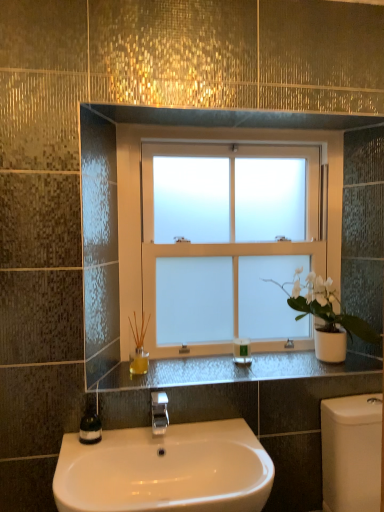
This screenshot has height=512, width=384. Describe the element at coordinates (203, 140) in the screenshot. I see `frosted glass window at center` at that location.

At what (x,y) coordinates should I click in order to perform the action: click on black granite counter at center. Please return your answer as a coordinate pair (x, y). This screenshot has width=384, height=512. Looking at the image, I should click on (232, 371).

The image size is (384, 512). What do you see at coordinates (159, 412) in the screenshot? I see `silver metallic faucet at center` at bounding box center [159, 412].

Find the location of a particular element. The image size is (384, 512). white glossy sink at lower center is located at coordinates (165, 470).

Can we say green glass soap dispenser at lower left lies outside green plastic bottle at center?

Yes, green glass soap dispenser at lower left is not within green plastic bottle at center.

Does green glass soap dispenser at lower left appear on the left side of green plastic bottle at center?

Correct, you'll find green glass soap dispenser at lower left to the left of green plastic bottle at center.

Considering the relative sizes of green glass soap dispenser at lower left and green plastic bottle at center in the image provided, is green glass soap dispenser at lower left taller than green plastic bottle at center?

Indeed, green glass soap dispenser at lower left has a greater height compared to green plastic bottle at center.

Is the surface of white matte pot at right in direct contact with green glass soap dispenser at lower left?

No, white matte pot at right is not touching green glass soap dispenser at lower left.

Is white matte pot at right aimed at green glass soap dispenser at lower left?

No, white matte pot at right is not aimed at green glass soap dispenser at lower left.

Is white matte pot at right positioned before green glass soap dispenser at lower left?

No, the depth of white matte pot at right is greater than that of green glass soap dispenser at lower left.

The height and width of the screenshot is (512, 384). In order to click on soap dispenser that is in front of the white matte pot at right in this screenshot , I will do point(90,423).

Can you see silver metallic faucet at center touching green glass soap dispenser at lower left?

No, silver metallic faucet at center is not beside green glass soap dispenser at lower left.

Consider the image. Is the depth of silver metallic faucet at center greater than that of green glass soap dispenser at lower left?

No, silver metallic faucet at center is closer to the camera.

Is point (155, 426) farther from camera compared to point (93, 428)?

That is False.

I want to click on houseplant above the white glossy sink at lower center (from a real-world perspective), so [325, 307].

From the picture: Which of these two, white glossy sink at lower center or white matte pot at right, stands shorter?

white glossy sink at lower center is shorter.

Is white glossy sink at lower center positioned with its back to white matte pot at right?

That's not correct — white glossy sink at lower center is not looking away from white matte pot at right.

In the scene shown: Is white glossy sink at lower center behind white matte pot at right?

No, it is not.

Is white glossy sink at lower center positioned far away from green glass soap dispenser at lower left?

No, white glossy sink at lower center is not far away from green glass soap dispenser at lower left.

Is white glossy sink at lower center facing away from green glass soap dispenser at lower left?

That's not correct — white glossy sink at lower center is not looking away from green glass soap dispenser at lower left.

In the image, there is a white glossy sink at lower center. Find the location of `soap dispenser above it (from the image's perspective)`. soap dispenser above it (from the image's perspective) is located at coordinates point(90,423).

Is white glossy sink at lower center to the left or to the right of green glass soap dispenser at lower left in the image?

Clearly, white glossy sink at lower center is on the right of green glass soap dispenser at lower left in the image.

Between green glass soap dispenser at lower left and silver metallic faucet at center, which one has more height?

silver metallic faucet at center is taller.

Is green glass soap dispenser at lower left bigger or smaller than silver metallic faucet at center?

Clearly, green glass soap dispenser at lower left is smaller in size than silver metallic faucet at center.

The width and height of the screenshot is (384, 512). What are the coordinates of `tap on the right side of green glass soap dispenser at lower left` in the screenshot? It's located at (159, 412).

Can silver metallic faucet at center be found inside green glass soap dispenser at lower left?

No, green glass soap dispenser at lower left does not contain silver metallic faucet at center.

From the picture: Considering the sizes of objects frosted glass window at center and white matte pot at right in the image provided, who is taller, frosted glass window at center or white matte pot at right?

frosted glass window at center is taller.

Is point (127, 306) closer to viewer compared to point (341, 318)?

No.

Between frosted glass window at center and white matte pot at right, which one has smaller size?

white matte pot at right.

Based on their positions, is frosted glass window at center located to the left or right of white matte pot at right?

From the image, it's evident that frosted glass window at center is to the left of white matte pot at right.

Where is `soap dispenser that appears in front of the green plastic bottle at center`? soap dispenser that appears in front of the green plastic bottle at center is located at coordinates (90, 423).

At what (x,y) coordinates should I click in order to perform the action: click on soap dispenser on the left of white matte pot at right. Please return your answer as a coordinate pair (x, y). Looking at the image, I should click on (90, 423).

When comparing their distances from white glossy sink at lower center, does frosted glass window at center or green glass soap dispenser at lower left seem further?

frosted glass window at center lies further to white glossy sink at lower center than the other object.

Estimate the real-world distances between objects in this image. Which object is closer to white matte pot at right, green plastic bottle at center or black granite counter at center?

Based on the image, black granite counter at center appears to be nearer to white matte pot at right.

From the image, which object appears to be nearer to green plastic bottle at center, silver metallic faucet at center or black granite counter at center?

Based on the image, black granite counter at center appears to be nearer to green plastic bottle at center.

Considering their positions, is green plastic bottle at center positioned closer to white glossy sink at lower center than black granite counter at center?

black granite counter at center is positioned closer to the anchor white glossy sink at lower center.

Considering their positions, is green glass soap dispenser at lower left positioned closer to frosted glass window at center than black granite counter at center?

The object closer to frosted glass window at center is black granite counter at center.

Looking at the image, which one is located closer to white matte pot at right, green glass soap dispenser at lower left or green plastic bottle at center?

green plastic bottle at center is positioned closer to the anchor white matte pot at right.

In the scene shown: Based on their spatial positions, is silver metallic faucet at center or green glass soap dispenser at lower left further from black granite counter at center?

green glass soap dispenser at lower left is further to black granite counter at center.

Considering their positions, is white glossy sink at lower center positioned further to frosted glass window at center than green plastic bottle at center?

green plastic bottle at center lies further to frosted glass window at center than the other object.

The image size is (384, 512). In order to click on counter between white glossy sink at lower center and green plastic bottle at center from front to back in this screenshot , I will do `click(232, 371)`.

This screenshot has width=384, height=512. Find the location of `tap between white glossy sink at lower center and black granite counter at center in the front-back direction`. tap between white glossy sink at lower center and black granite counter at center in the front-back direction is located at coordinates (159, 412).

Find the location of a particular element. This screenshot has width=384, height=512. toiletry between frosted glass window at center and silver metallic faucet at center in the up-down direction is located at coordinates (241, 351).

Locate an element on the screen. sink situated between silver metallic faucet at center and white matte pot at right from left to right is located at coordinates (165, 470).